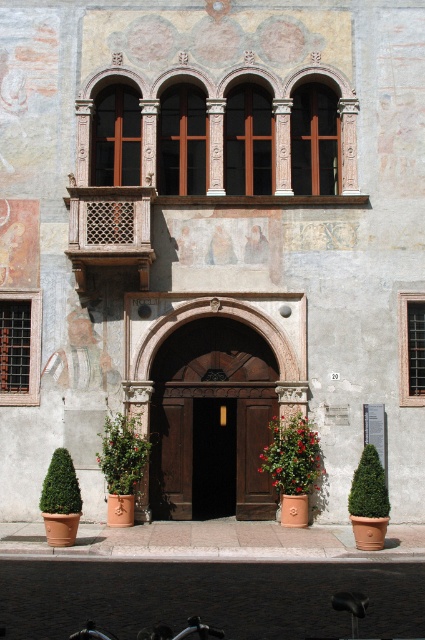
Question: Which of the following is the closest to the observer?

Choices:
 (A) green leafy plant at lower center
 (B) red matte flower pot at lower center
 (C) black wooden door at center
 (D) green leafy bush at lower right

Answer: (D)

Question: Among these points, which one is farthest from the camera?

Choices:
 (A) (184, 429)
 (B) (62, 474)
 (C) (198, 413)
 (D) (359, 506)

Answer: (C)

Question: Is red matte flower pot at lower center positioned in front of green leafy bush at lower left?

Choices:
 (A) yes
 (B) no

Answer: (B)

Question: Can you confirm if green leafy bush at lower right is bigger than green leafy bush at lower left?

Choices:
 (A) yes
 (B) no

Answer: (A)

Question: Does dark wood door at center appear over green leafy bush at lower left?

Choices:
 (A) yes
 (B) no

Answer: (A)

Question: Which object appears farthest from the camera in this image?

Choices:
 (A) black wooden door at center
 (B) dark wood door at center

Answer: (A)